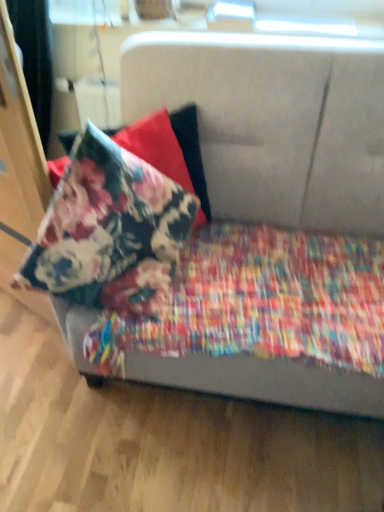
In order to face textured fabric couch at center, should I rotate leftwards or rightwards?

Rotate right and turn 9.765 degrees.

Where is `floral fabric pillow at upper left`? This screenshot has width=384, height=512. floral fabric pillow at upper left is located at coordinates (105, 222).

You are a GUI agent. You are given a task and a screenshot of the screen. Output one action in this format:
    pyautogui.click(x=<x>, y=<y>)
    Task: Click on the textured fabric couch at center
    The width and height of the screenshot is (384, 512).
    Given the screenshot: What is the action you would take?
    pyautogui.click(x=276, y=121)

From the image's perspective, which object appears higher, floral fabric pillow at upper left or textured fabric couch at center?

From the image's view, floral fabric pillow at upper left is above.

Which of these two, floral fabric pillow at upper left or textured fabric couch at center, is wider?

Wider between the two is textured fabric couch at center.

Considering the relative sizes of floral fabric pillow at upper left and textured fabric couch at center in the image provided, is floral fabric pillow at upper left bigger than textured fabric couch at center?

Actually, floral fabric pillow at upper left might be smaller than textured fabric couch at center.

Locate an element on the screen. The height and width of the screenshot is (512, 384). studio couch in front of the floral fabric pillow at upper left is located at coordinates (276, 121).

Is floral cotton blanket at lower left inside textured fabric couch at center?

Yes, floral cotton blanket at lower left is a part of textured fabric couch at center.

How much distance is there between textured fabric couch at center and floral cotton blanket at lower left?

The distance of textured fabric couch at center from floral cotton blanket at lower left is 13.21 inches.

Which is behind, textured fabric couch at center or floral cotton blanket at lower left?

floral cotton blanket at lower left is further away from the camera.

Is point (265, 100) closer to camera compared to point (330, 277)?

No, it is behind (330, 277).

Does floral fabric pillow at upper left appear on the right side of floral cotton blanket at lower left?

No.

How different are the orientations of floral fabric pillow at upper left and floral cotton blanket at lower left in degrees?

floral fabric pillow at upper left and floral cotton blanket at lower left are facing 29.2 degrees away from each other.

Is floral cotton blanket at lower left completely or partially inside floral fabric pillow at upper left?

No, floral fabric pillow at upper left does not contain floral cotton blanket at lower left.

From the image's perspective, who appears lower, floral cotton blanket at lower left or floral fabric pillow at upper left?

floral cotton blanket at lower left is shown below in the image.

From a real-world perspective, is floral cotton blanket at lower left positioned under floral fabric pillow at upper left based on gravity?

Yes.

Is floral fabric pillow at upper left at the back of floral cotton blanket at lower left?

No.

Does textured fabric couch at center contain floral fabric pillow at upper left?

Yes.

How different are the orientations of textured fabric couch at center and floral fabric pillow at upper left in degrees?

The angle between the facing direction of textured fabric couch at center and the facing direction of floral fabric pillow at upper left is 28.3 degrees.

Find the location of a particular element. This screenshot has height=512, width=384. pillow that is above the textured fabric couch at center (from the image's perspective) is located at coordinates (105, 222).

Is textured fabric couch at center wider than floral fabric pillow at upper left?

Yes, textured fabric couch at center is wider than floral fabric pillow at upper left.

Is floral cotton blanket at lower left to the right of textured fabric couch at center from the viewer's perspective?

In fact, floral cotton blanket at lower left is to the left of textured fabric couch at center.

Which object is closer to the camera, floral cotton blanket at lower left or textured fabric couch at center?

Positioned in front is textured fabric couch at center.

From the image's perspective, which is below, floral cotton blanket at lower left or textured fabric couch at center?

floral cotton blanket at lower left is shown below in the image.

Identify the location of blanket that appears below the textured fabric couch at center (from the image's perspective). (259, 302).

You are a GUI agent. You are given a task and a screenshot of the screen. Output one action in this format:
    pyautogui.click(x=<x>, y=<y>)
    Task: Click on the studio couch on the right of the floral fabric pillow at upper left
    The height and width of the screenshot is (512, 384).
    Given the screenshot: What is the action you would take?
    pyautogui.click(x=276, y=121)

Locate an element on the screen. blanket that is on the left side of textured fabric couch at center is located at coordinates (259, 302).

Based on their spatial positions, is floral fabric pillow at upper left or floral cotton blanket at lower left further from textured fabric couch at center?

Among the two, floral fabric pillow at upper left is located further to textured fabric couch at center.

Estimate the real-world distances between objects in this image. Which object is closer to floral cotton blanket at lower left, floral fabric pillow at upper left or textured fabric couch at center?

The object closer to floral cotton blanket at lower left is floral fabric pillow at upper left.

Based on their spatial positions, is floral cotton blanket at lower left or floral fabric pillow at upper left further from textured fabric couch at center?

Among the two, floral fabric pillow at upper left is located further to textured fabric couch at center.

When comparing their distances from floral cotton blanket at lower left, does textured fabric couch at center or floral fabric pillow at upper left seem closer?

Based on the image, floral fabric pillow at upper left appears to be nearer to floral cotton blanket at lower left.

Which object lies nearer to the anchor point floral fabric pillow at upper left, textured fabric couch at center or floral cotton blanket at lower left?

floral cotton blanket at lower left is positioned closer to the anchor floral fabric pillow at upper left.

From the image, which object appears to be farther from floral fabric pillow at upper left, floral cotton blanket at lower left or textured fabric couch at center?

The object further to floral fabric pillow at upper left is textured fabric couch at center.

Identify the location of blanket situated between floral fabric pillow at upper left and textured fabric couch at center from left to right. (259, 302).